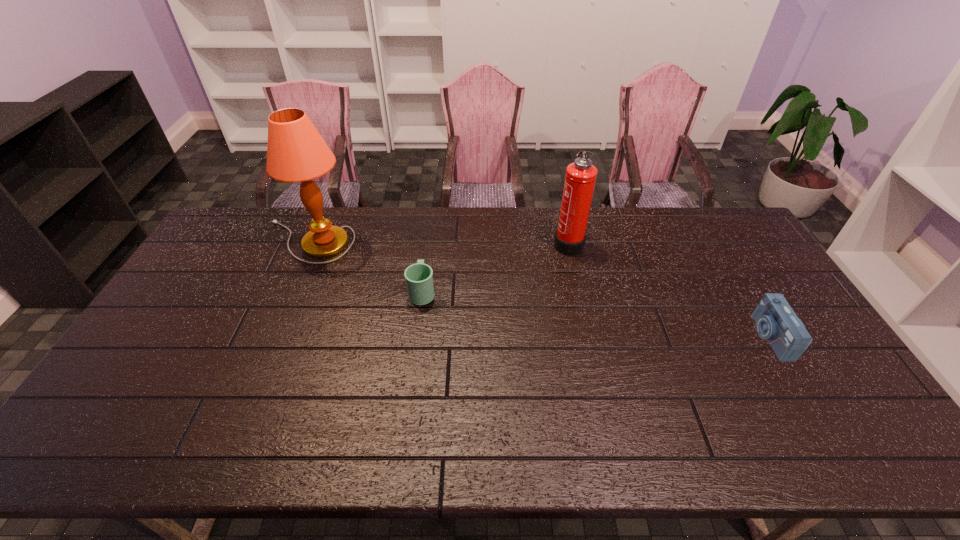
Locate an element on the screen. object that is at the right edge is located at coordinates (776, 322).

The height and width of the screenshot is (540, 960). Identify the location of free region at the far edge of the desktop. (423, 248).

In the image, there is a desktop. Where is `vacant space at the near edge`? This screenshot has width=960, height=540. vacant space at the near edge is located at coordinates (770, 446).

Locate an element on the screen. vacant region at the left edge is located at coordinates (127, 371).

At what (x,y) coordinates should I click in order to perform the action: click on vacant space at the right edge of the desktop. Please return your answer as a coordinate pair (x, y). The image size is (960, 540). Looking at the image, I should click on coord(796,312).

You are a GUI agent. You are given a task and a screenshot of the screen. Output one action in this format:
    pyautogui.click(x=<x>, y=<y>)
    Task: Click on the free space at the near left corner of the desktop
    
    Given the screenshot: What is the action you would take?
    pyautogui.click(x=98, y=445)

The width and height of the screenshot is (960, 540). I want to click on free space at the far right corner of the desktop, so click(x=748, y=245).

You are a GUI agent. You are given a task and a screenshot of the screen. Output one action in this format:
    pyautogui.click(x=<x>, y=<y>)
    Task: Click on the vacant area that lies between the leftmost object and the fire extinguisher
    
    Given the screenshot: What is the action you would take?
    pyautogui.click(x=438, y=242)

Locate an element on the screen. The width and height of the screenshot is (960, 540). vacant space that is in between the rightmost object and the third object from right to left is located at coordinates (596, 314).

The height and width of the screenshot is (540, 960). In order to click on vacant area that lies between the second nearest object and the rightmost object in this screenshot , I will do `click(596, 314)`.